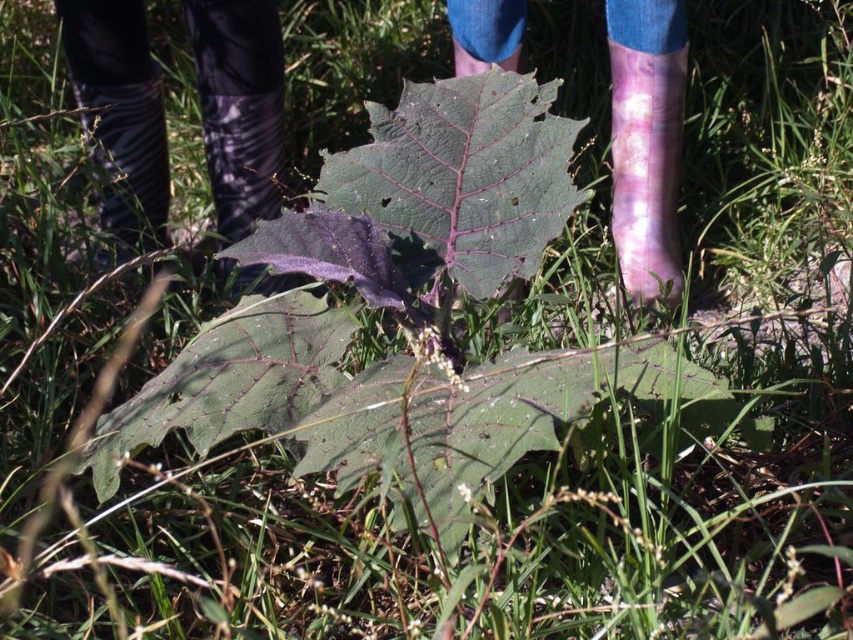
You are a photographer using a camera with a 50mm lens. You want to capture a closeup of the purple matte leaf at center without any distortion. Given that the leaf is 37.95 inches away from the camera, what is the minimum distance you should keep between the camera and the leaf to avoid distortion?

The purple matte leaf at center is 37.95 inches away from the camera. To avoid distortion with a 50mm lens, the minimum distance should be at least twice the focal length, so 100mm or approximately 39.37 inches. Since 37.95 inches is slightly less than this, you should move the camera back to at least 39.37 inches away from the leaf.

In the scene shown: You are a gardener who needs to reach the purple matte leaf at center without stepping on the purple rubber boot at center. Can you do it comfortably?

The distance between the purple matte leaf at center and the purple rubber boot at center is 1.14 meters, so yes, you can comfortably reach the leaf without stepping on the boot since the distance allows enough space to maneuver around the boot.